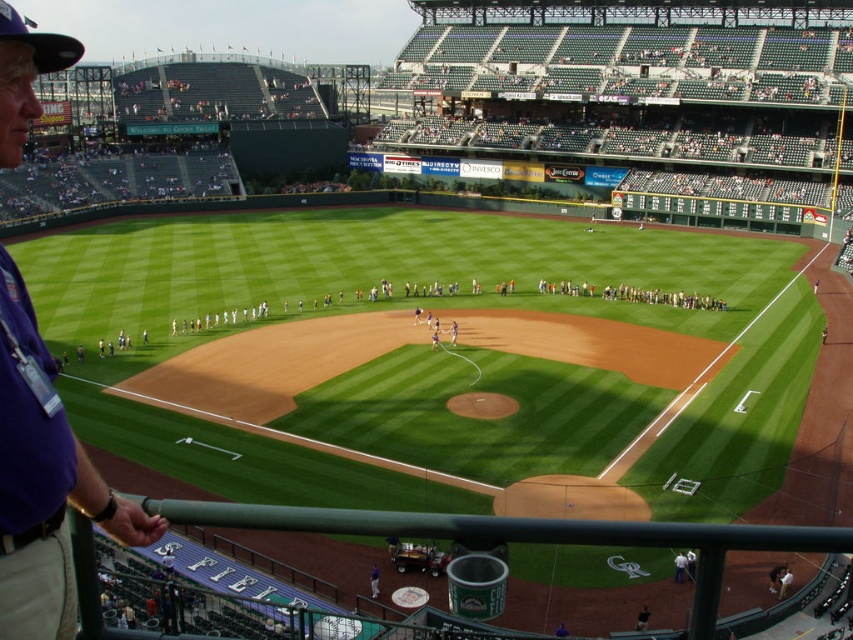
You are standing at the railing in front of the COORS FIELD sign. You want to take a photo of the white uniform players at center. Where should you point your camera?

You should point your camera towards the center of the image at point coordinates approximately 0.467 on the x axis and 0.756 on the y axis to capture the white uniform players at center.

You are standing at the position of the person in the purple shirt and beige pants on the left side of the frame. You want to throw a baseball to the white uniform players at center. The baseball is in your hand. Can you reach them by throwing the ball? Explain your answer.

The white uniform players at center are 58.12 meters away from the camera. Since the average throwing distance for a person is around 30 meters, you cannot reach them by throwing the ball.

You are standing at the railing at COORS FIELD and see the purple fabric shirt at left and the white shirt at lower right. Which person is closer to the railing?

The purple fabric shirt at left is closer to the railing because it is positioned over the white shirt at lower right, indicating it is in front.